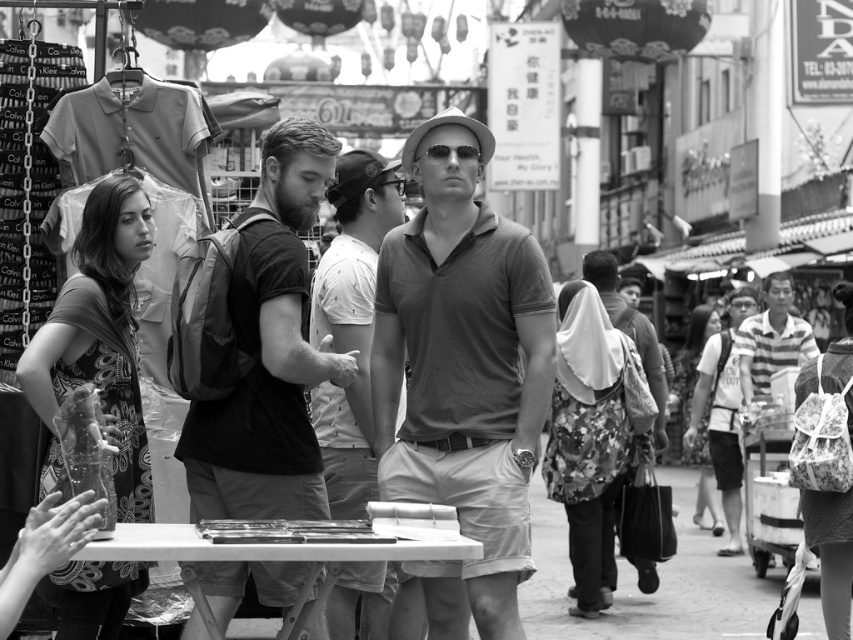
You are a photographer trying to capture both the smooth gray shirt at center and the floral fabric bag at right in a single frame. Which object should you focus on first to ensure both are in the frame?

The smooth gray shirt at center is bigger than the floral fabric bag at right, so you should focus on the smooth gray shirt at center first to ensure both are in the frame.

Based on the scene description, where is the smooth gray shirt at center located in terms of coordinates?

The smooth gray shirt at center is located at coordinates point (351, 323).